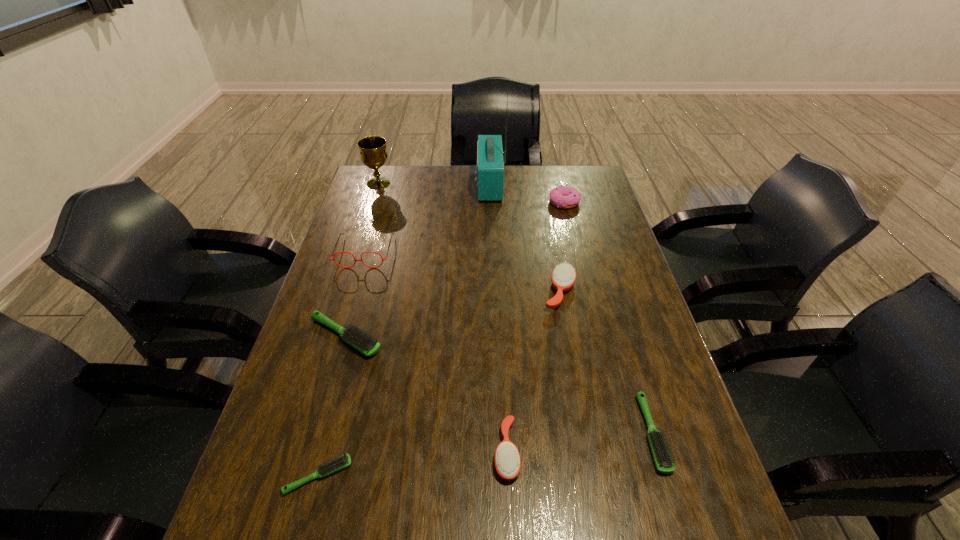
Locate an element on the screen. This screenshot has height=540, width=960. the biggest light hairbrush is located at coordinates (365, 344).

The image size is (960, 540). I want to click on the left orange hairbrush, so click(507, 458).

Find the location of a particular element. Image resolution: width=960 pixels, height=540 pixels. the smaller orange hairbrush is located at coordinates (507, 458).

Locate an element on the screen. This screenshot has height=540, width=960. the fourth tallest hairbrush is located at coordinates (662, 457).

You are a GUI agent. You are given a task and a screenshot of the screen. Output one action in this format:
    pyautogui.click(x=<x>, y=<y>)
    Task: Click on the rightmost light hairbrush
    Image resolution: width=960 pixels, height=540 pixels.
    Given the screenshot: What is the action you would take?
    pyautogui.click(x=662, y=457)

I want to click on the smallest light hairbrush, so click(x=344, y=461).

You are a GUI agent. You are given a task and a screenshot of the screen. Output one action in this format:
    pyautogui.click(x=<x>, y=<y>)
    Task: Click on the shortest hairbrush
    The image size is (960, 540).
    Given the screenshot: What is the action you would take?
    pyautogui.click(x=344, y=461)

Identify the location of free space located 0.340m on the front panel of the light radio receiver. This screenshot has width=960, height=540. (386, 185).

Where is `free point located on the front panel of the light radio receiver`? free point located on the front panel of the light radio receiver is located at coordinates (399, 185).

In order to click on free space located 0.130m on the front panel of the light radio receiver in this screenshot , I will do `click(442, 185)`.